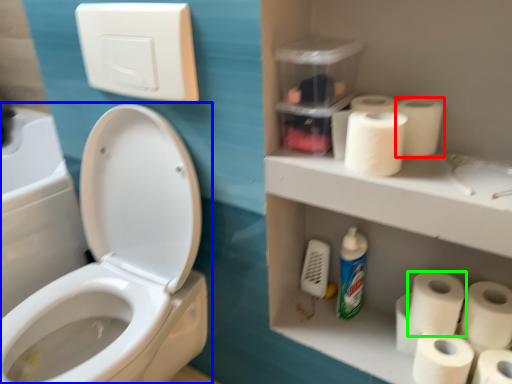
Question: Considering the real-world distances, which object is farthest from toilet paper (highlighted by a red box)? toilet (highlighted by a blue box) or toilet paper (highlighted by a green box)?

Choices:
 (A) toilet
 (B) toilet paper

Answer: (A)